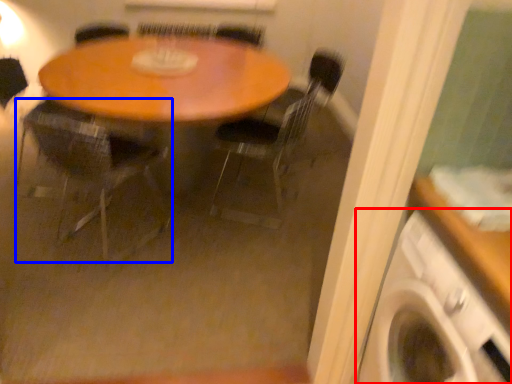
Question: Which of the following is the farthest to the observer, washing machine (highlighted by a red box) or chair (highlighted by a blue box)?

Choices:
 (A) washing machine
 (B) chair

Answer: (B)